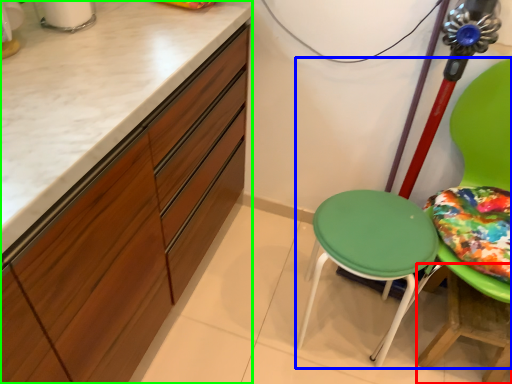
Question: Considering the real-world distances, which object is closest to table (highlighted by a red box)? chair (highlighted by a blue box) or cabinetry (highlighted by a green box).

Choices:
 (A) chair
 (B) cabinetry

Answer: (A)